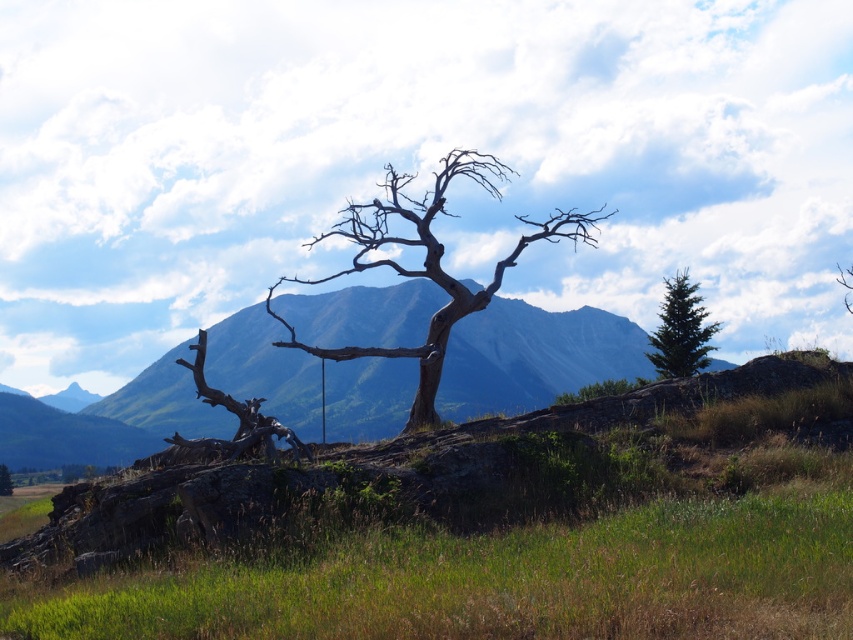
Looking at this image, you are standing at the base of the barren tree in the foreground of the landscape. You notice two points marked in the scene. The first point is at coordinates point (431, 195), and the second is at point (9, 472). If you were to walk directly toward the second point, would you pass by the first point along the way?

Yes, because point (431, 195) is in front of point (9, 472), so walking toward the second point would require passing the first point first.

You are a hiker trying to navigate through the landscape. You need to find an area with more coverage to set up your tent. Which location between the green grassy at lower center and the green glossy evergreen tree at upper right would you choose?

The green glossy evergreen tree at upper right occupies more space than the green grassy at lower center, so you should choose the area near the green glossy evergreen tree at upper right for setting up your tent as it provides more coverage.

You are an environmental scientist studying the landscape. You observe the brown rough bark tree at center and the brown rough tree trunk at center. Which one is closer to you?

The brown rough bark tree at center is closer to you because it is in front of the brown rough tree trunk at center.